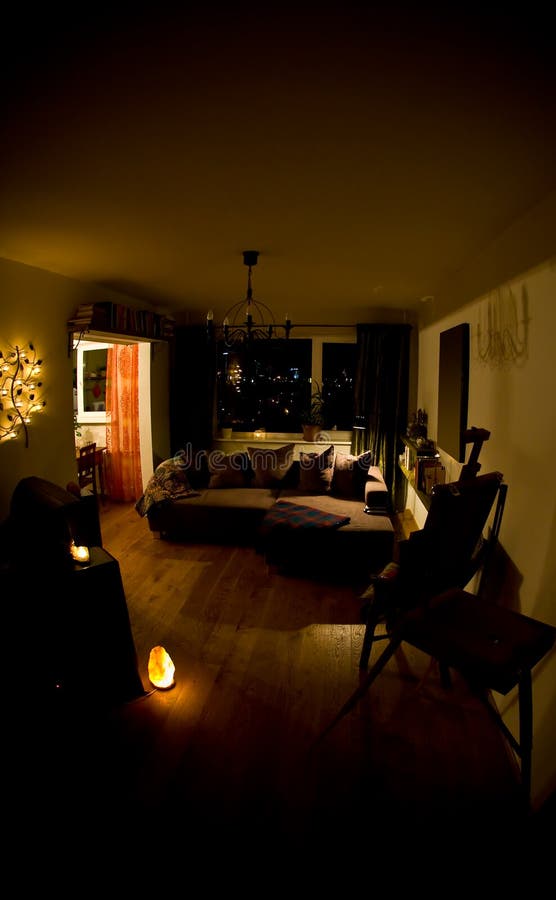
At what (x,y) coordinates should I click in order to perform the action: click on wood floor. Please return your answer as a coordinate pair (x, y). Looking at the image, I should click on (261, 663).